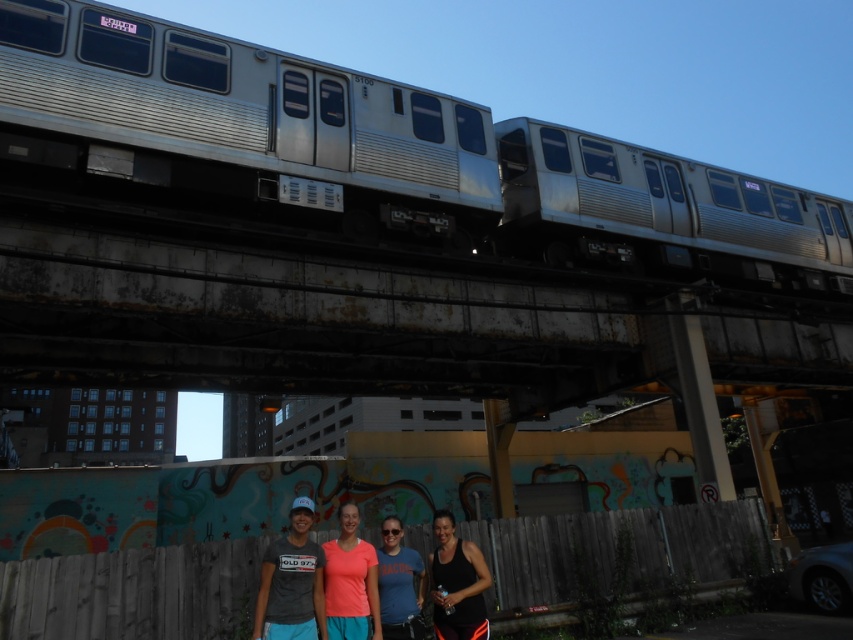
Can you confirm if matte coral t-shirt at center is positioned above matte blue t-shirt at center?

Yes, matte coral t-shirt at center is above matte blue t-shirt at center.

Can you confirm if matte coral t-shirt at center is positioned to the right of matte blue t-shirt at center?

Incorrect, matte coral t-shirt at center is not on the right side of matte blue t-shirt at center.

Is point (354, 588) farther from viewer compared to point (418, 616)?

No.

You are a GUI agent. You are given a task and a screenshot of the screen. Output one action in this format:
    pyautogui.click(x=<x>, y=<y>)
    Task: Click on the matte coral t-shirt at center
    This screenshot has height=640, width=853.
    Given the screenshot: What is the action you would take?
    pyautogui.click(x=350, y=580)

Who is lower down, silver metallic train at upper center or matte coral t-shirt at center?

Positioned lower is matte coral t-shirt at center.

Is silver metallic train at upper center closer to the viewer compared to matte coral t-shirt at center?

That is False.

Who is more forward, [235,54] or [347,589]?

Point [347,589] is more forward.

Find the location of a particular element. silver metallic train at upper center is located at coordinates (383, 157).

Does silver metallic train at upper center have a greater width compared to black tank top at center?

Indeed, silver metallic train at upper center has a greater width compared to black tank top at center.

Find the location of a particular element. silver metallic train at upper center is located at coordinates (383, 157).

This screenshot has height=640, width=853. What are the coordinates of `silver metallic train at upper center` in the screenshot? It's located at (383, 157).